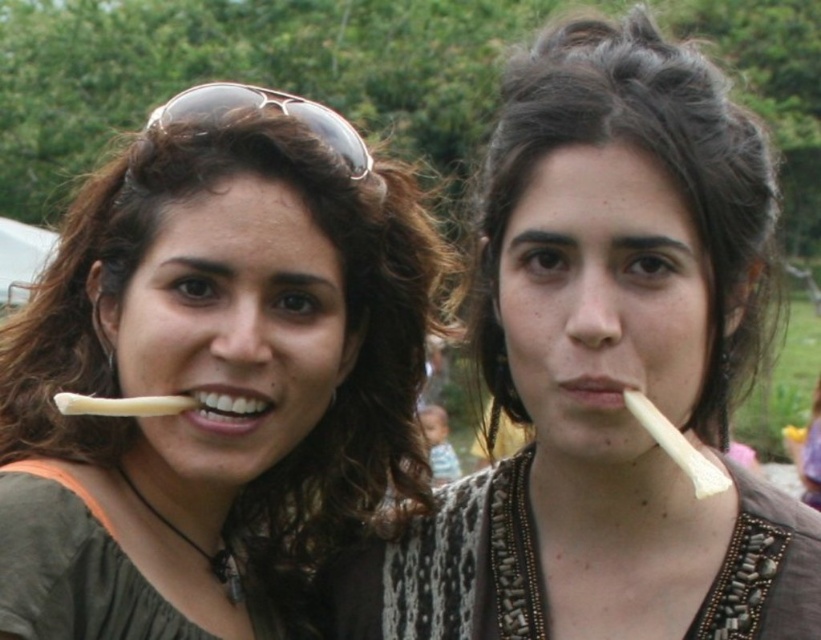
Is matte white bone at left wider than brown reflective sunglasses at upper left?

No.

Can you confirm if matte white bone at left is bigger than brown reflective sunglasses at upper left?

Actually, matte white bone at left might be smaller than brown reflective sunglasses at upper left.

Is point (359, 141) positioned before point (154, 115)?

Yes, point (359, 141) is closer to viewer.

What are the coordinates of `matte white bone at left` in the screenshot? It's located at (213, 374).

Does matte white bone at left have a larger size compared to white glossy toothpick at lower left?

Yes, matte white bone at left is bigger than white glossy toothpick at lower left.

Can you confirm if matte white bone at left is positioned above white glossy toothpick at lower left?

No.

Locate an element on the screen. Image resolution: width=821 pixels, height=640 pixels. matte white bone at left is located at coordinates (213, 374).

Where is `matte white bone at left`? matte white bone at left is located at coordinates (213, 374).

Is matte white toothpick at center wider than white glossy toothpick at lower left?

No.

Which is behind, point (618, 408) or point (198, 406)?

The point (198, 406) is more distant.

Which is behind, point (626, 387) or point (255, 410)?

Point (255, 410)

Locate an element on the screen. Image resolution: width=821 pixels, height=640 pixels. matte white toothpick at center is located at coordinates (594, 388).